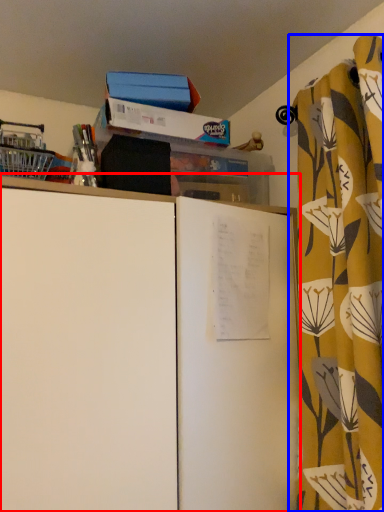
Question: Which object is further to the camera taking this photo, cupboard (highlighted by a red box) or curtain (highlighted by a blue box)?

Choices:
 (A) cupboard
 (B) curtain

Answer: (B)